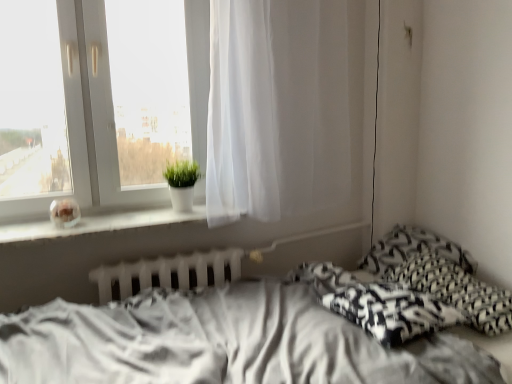
The width and height of the screenshot is (512, 384). Describe the element at coordinates (98, 223) in the screenshot. I see `white matte window sill at left` at that location.

What do you see at coordinates (277, 108) in the screenshot?
I see `white sheer curtain at center` at bounding box center [277, 108].

What do you see at coordinates (413, 249) in the screenshot? Image resolution: width=512 pixels, height=384 pixels. I see `black printed pillow at right, which is the second pillow in front-to-back order` at bounding box center [413, 249].

Locate an element on the screen. Image resolution: width=512 pixels, height=384 pixels. black printed pillow at right, the first pillow in the back-to-front sequence is located at coordinates (413, 249).

The height and width of the screenshot is (384, 512). Describe the element at coordinates (224, 343) in the screenshot. I see `white fabric bed at lower right` at that location.

I want to click on black and white patterned pillow at lower right, which ranks as the 2th pillow in back-to-front order, so click(x=456, y=290).

In the scene shown: Are black printed pillow at right, the first pillow in the back-to-front sequence, and white plastic radiator at lower center far apart?

black printed pillow at right, the first pillow in the back-to-front sequence, is near white plastic radiator at lower center, not far away.

Is black printed pillow at right, which is the second pillow in front-to-back order, facing away from white plastic radiator at lower center?

No, black printed pillow at right, which is the second pillow in front-to-back order, is not facing away from white plastic radiator at lower center.

From the image's perspective, which is below, black printed pillow at right, which is the second pillow in front-to-back order, or white plastic radiator at lower center?

white plastic radiator at lower center, from the image's perspective.

Considering the positions of objects black printed pillow at right, the first pillow in the back-to-front sequence, and white plastic radiator at lower center in the image provided, who is more to the left, black printed pillow at right, the first pillow in the back-to-front sequence, or white plastic radiator at lower center?

white plastic radiator at lower center is more to the left.

Which is more to the left, white sheer curtain at center or white plastic radiator at lower center?

white plastic radiator at lower center is more to the left.

Is white sheer curtain at center turned away from white plastic radiator at lower center?

No, white plastic radiator at lower center is not at the back of white sheer curtain at center.

Does white sheer curtain at center have a greater height compared to white plastic radiator at lower center?

Yes, white sheer curtain at center is taller than white plastic radiator at lower center.

Who is shorter, black and white patterned pillow at lower right, the 1th pillow when ordered from front to back, or white plastic radiator at lower center?

Standing shorter between the two is black and white patterned pillow at lower right, the 1th pillow when ordered from front to back.

Is black and white patterned pillow at lower right, which ranks as the 2th pillow in back-to-front order, at the left side of white plastic radiator at lower center?

Incorrect, black and white patterned pillow at lower right, which ranks as the 2th pillow in back-to-front order, is not on the left side of white plastic radiator at lower center.

In the scene shown: Would you say black and white patterned pillow at lower right, which ranks as the 2th pillow in back-to-front order, is outside white plastic radiator at lower center?

Indeed, black and white patterned pillow at lower right, which ranks as the 2th pillow in back-to-front order, is completely outside white plastic radiator at lower center.

Is black and white patterned pillow at lower right, which ranks as the 2th pillow in back-to-front order, with white plastic radiator at lower center?

No, black and white patterned pillow at lower right, which ranks as the 2th pillow in back-to-front order, is not with white plastic radiator at lower center.

Is green matte plant at window completely or partially outside of black and white patterned pillow at lower right, the 1th pillow when ordered from front to back?

That's correct, green matte plant at window is outside of black and white patterned pillow at lower right, the 1th pillow when ordered from front to back.

Is green matte plant at window not close to black and white patterned pillow at lower right, which ranks as the 2th pillow in back-to-front order?

Indeed, green matte plant at window is not near black and white patterned pillow at lower right, which ranks as the 2th pillow in back-to-front order.

Considering the positions of point (172, 175) and point (473, 287), is point (172, 175) closer or farther from the camera than point (473, 287)?

Point (172, 175) appears to be farther away from the viewer than point (473, 287).

From a real-world perspective, does green matte plant at window stand above black and white patterned pillow at lower right, which ranks as the 2th pillow in back-to-front order?

Yes, from a real-world perspective, green matte plant at window is on top of black and white patterned pillow at lower right, which ranks as the 2th pillow in back-to-front order.

From a real-world perspective, is white matte window sill at left below black and white patterned pillow at lower right, which ranks as the 2th pillow in back-to-front order?

No, from a real-world perspective, white matte window sill at left is not under black and white patterned pillow at lower right, which ranks as the 2th pillow in back-to-front order.

Is white matte window sill at left shorter than black and white patterned pillow at lower right, the 1th pillow when ordered from front to back?

Indeed, white matte window sill at left has a lesser height compared to black and white patterned pillow at lower right, the 1th pillow when ordered from front to back.

Is white matte window sill at left not inside black and white patterned pillow at lower right, which ranks as the 2th pillow in back-to-front order?

Yes.

From the image's perspective, is white matte window sill at left located above or below black and white patterned pillow at lower right, which ranks as the 2th pillow in back-to-front order?

white matte window sill at left is situated higher than black and white patterned pillow at lower right, which ranks as the 2th pillow in back-to-front order, in the image.

Could you tell me if black and white woven blanket at lower right is facing white matte window sill at left?

No, black and white woven blanket at lower right is not turned towards white matte window sill at left.

Is black and white woven blanket at lower right directly adjacent to white matte window sill at left?

black and white woven blanket at lower right is not next to white matte window sill at left, and they're not touching.

Which of these two, black and white woven blanket at lower right or white matte window sill at left, is bigger?

With larger size is black and white woven blanket at lower right.

Is white matte window sill at left thinner than white sheer curtain at center?

Incorrect, the width of white matte window sill at left is not less than that of white sheer curtain at center.

This screenshot has height=384, width=512. I want to click on curtain that appears above the white matte window sill at left (from a real-world perspective), so click(x=277, y=108).

Considering the relative positions of white matte window sill at left and white sheer curtain at center in the image provided, is white matte window sill at left to the left or to the right of white sheer curtain at center?

From the image, it's evident that white matte window sill at left is to the left of white sheer curtain at center.

Looking at this image, measure the distance from white matte window sill at left to white sheer curtain at center.

The distance of white matte window sill at left from white sheer curtain at center is 59.68 centimeters.

You are a GUI agent. You are given a task and a screenshot of the screen. Output one action in this format:
    pyautogui.click(x=<x>, y=<y>)
    Task: Click on the pillow above the white plastic radiator at lower center (from the image's perspective)
    Image resolution: width=512 pixels, height=384 pixels.
    Given the screenshot: What is the action you would take?
    tap(413, 249)

You are a GUI agent. You are given a task and a screenshot of the screen. Output one action in this format:
    pyautogui.click(x=<x>, y=<y>)
    Task: Click on the radiator located behind the white sheer curtain at center
    Image resolution: width=512 pixels, height=384 pixels.
    Given the screenshot: What is the action you would take?
    (168, 272)

Based on their spatial positions, is black printed pillow at right, which is the second pillow in front-to-back order, or white fabric bed at lower right closer to white matte window sill at left?

white fabric bed at lower right is positioned closer to the anchor white matte window sill at left.

Which object lies further to the anchor point white plastic radiator at lower center, black and white patterned pillow at lower right, which ranks as the 2th pillow in back-to-front order, or white matte window sill at left?

black and white patterned pillow at lower right, which ranks as the 2th pillow in back-to-front order, is positioned further to the anchor white plastic radiator at lower center.

Considering their positions, is black and white woven blanket at lower right positioned further to white glossy vase at upper left than white matte window sill at left?

black and white woven blanket at lower right is positioned further to the anchor white glossy vase at upper left.

Looking at this image, considering their positions, is white matte window sill at left positioned closer to black and white patterned pillow at lower right, which ranks as the 2th pillow in back-to-front order, than white sheer curtain at center?

white sheer curtain at center lies closer to black and white patterned pillow at lower right, which ranks as the 2th pillow in back-to-front order, than the other object.

Which object lies nearer to the anchor point white fabric bed at lower right, white glossy vase at upper left or white plastic radiator at lower center?

Among the two, white plastic radiator at lower center is located nearer to white fabric bed at lower right.

Considering their positions, is white fabric bed at lower right positioned closer to green matte plant at window than white matte window sill at left?

The object closer to green matte plant at window is white matte window sill at left.

From the picture: Considering their positions, is white plastic radiator at lower center positioned closer to black printed pillow at right, which is the second pillow in front-to-back order, than white fabric bed at lower right?

Among the two, white fabric bed at lower right is located nearer to black printed pillow at right, which is the second pillow in front-to-back order.

Estimate the real-world distances between objects in this image. Which object is closer to black and white woven blanket at lower right, black printed pillow at right, the first pillow in the back-to-front sequence, or white matte window sill at left?

Among the two, black printed pillow at right, the first pillow in the back-to-front sequence, is located nearer to black and white woven blanket at lower right.

Find the location of a particular element. The height and width of the screenshot is (384, 512). houseplant located between white glossy vase at upper left and black printed pillow at right, which is the second pillow in front-to-back order, in the left-right direction is located at coordinates (182, 183).

At what (x,y) coordinates should I click in order to perform the action: click on window sill between white fabric bed at lower right and green matte plant at window along the z-axis. Please return your answer as a coordinate pair (x, y). Looking at the image, I should click on (98, 223).

You are a GUI agent. You are given a task and a screenshot of the screen. Output one action in this format:
    pyautogui.click(x=<x>, y=<y>)
    Task: Click on the houseplant between white glossy vase at upper left and white plastic radiator at lower center vertically
    The image size is (512, 384).
    Given the screenshot: What is the action you would take?
    pyautogui.click(x=182, y=183)

I want to click on houseplant between white glossy vase at upper left and white sheer curtain at center in the horizontal direction, so [x=182, y=183].